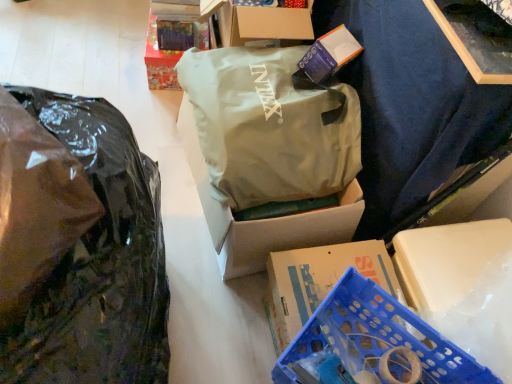
Question: Is shiny paper box at upper left taller than transparent plastic bag at left, which ranks as the 2th plastic bag in right-to-left order?

Choices:
 (A) yes
 (B) no

Answer: (B)

Question: Is shiny paper box at upper left oriented away from transparent plastic bag at left, which ranks as the 2th plastic bag in right-to-left order?

Choices:
 (A) no
 (B) yes

Answer: (A)

Question: Considering the relative sizes of shiny paper box at upper left and transparent plastic bag at left, which ranks as the 2th plastic bag in right-to-left order, in the image provided, is shiny paper box at upper left smaller than transparent plastic bag at left, which ranks as the 2th plastic bag in right-to-left order,?

Choices:
 (A) yes
 (B) no

Answer: (A)

Question: From the image's perspective, is shiny paper box at upper left located above transparent plastic bag at left, which ranks as the 2th plastic bag in right-to-left order?

Choices:
 (A) yes
 (B) no

Answer: (A)

Question: From the image's perspective, is shiny paper box at upper left located beneath transparent plastic bag at left, which ranks as the 2th plastic bag in right-to-left order?

Choices:
 (A) no
 (B) yes

Answer: (A)

Question: Considering the positions of blue plastic crate at lower right and blue plastic crate at lower right in the image, is blue plastic crate at lower right taller or shorter than blue plastic crate at lower right?

Choices:
 (A) short
 (B) tall

Answer: (A)

Question: From a real-world perspective, is blue plastic crate at lower right positioned above or below blue plastic crate at lower right?

Choices:
 (A) below
 (B) above

Answer: (B)

Question: Would you say blue plastic crate at lower right is inside or outside blue plastic crate at lower right?

Choices:
 (A) outside
 (B) inside

Answer: (A)

Question: Based on their positions, is blue plastic crate at lower right located to the left or right of blue plastic crate at lower right?

Choices:
 (A) right
 (B) left

Answer: (B)

Question: Based on their positions, is shiny paper box at upper left located to the left or right of blue plastic crate at lower right?

Choices:
 (A) right
 (B) left

Answer: (B)

Question: Is point (159, 28) closer or farther from the camera than point (343, 274)?

Choices:
 (A) farther
 (B) closer

Answer: (A)

Question: Is shiny paper box at upper left situated inside blue plastic crate at lower right or outside?

Choices:
 (A) outside
 (B) inside

Answer: (A)

Question: From their relative heights in the image, would you say shiny paper box at upper left is taller or shorter than blue plastic crate at lower right?

Choices:
 (A) short
 (B) tall

Answer: (B)

Question: In the image, is matte green fabric bag at center, the 1th plastic bag viewed from the right, positioned in front of or behind blue plastic crate at lower right?

Choices:
 (A) behind
 (B) front

Answer: (A)

Question: Considering the positions of matte green fabric bag at center, the 2th plastic bag in the left-to-right sequence, and blue plastic crate at lower right in the image, is matte green fabric bag at center, the 2th plastic bag in the left-to-right sequence, taller or shorter than blue plastic crate at lower right?

Choices:
 (A) short
 (B) tall

Answer: (B)